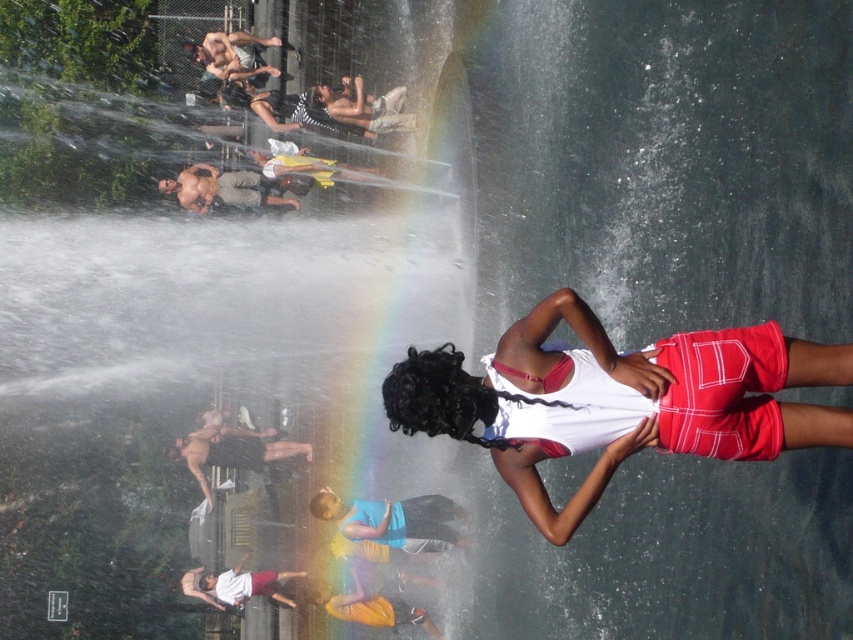
Between white fabric shorts at center and black fabric shirt at center, which one has more height?

white fabric shorts at center

Locate an element on the screen. The height and width of the screenshot is (640, 853). white fabric shorts at center is located at coordinates (618, 401).

You are a GUI agent. You are given a task and a screenshot of the screen. Output one action in this format:
    pyautogui.click(x=<x>, y=<y>)
    Task: Click on the white fabric shorts at center
    The image size is (853, 640).
    Given the screenshot: What is the action you would take?
    pyautogui.click(x=618, y=401)

Is point (572, 368) positioned before point (190, 173)?

Yes, point (572, 368) is in front of point (190, 173).

Between point (451, 420) and point (267, 204), which one is positioned in front?

Point (451, 420) is more forward.

This screenshot has width=853, height=640. Describe the element at coordinates (618, 401) in the screenshot. I see `white fabric shorts at center` at that location.

Where is `white fabric shorts at center`? This screenshot has width=853, height=640. white fabric shorts at center is located at coordinates (618, 401).

Does shiny metallic shorts at upper center have a lesser width compared to black fabric shirt at center?

Yes, shiny metallic shorts at upper center is thinner than black fabric shirt at center.

The height and width of the screenshot is (640, 853). Describe the element at coordinates (231, 188) in the screenshot. I see `shiny metallic shorts at upper center` at that location.

Does point (170, 192) come farther from viewer compared to point (245, 461)?

Yes, point (170, 192) is farther from viewer.

Where is `shiny metallic shorts at upper center`? The height and width of the screenshot is (640, 853). shiny metallic shorts at upper center is located at coordinates (231, 188).